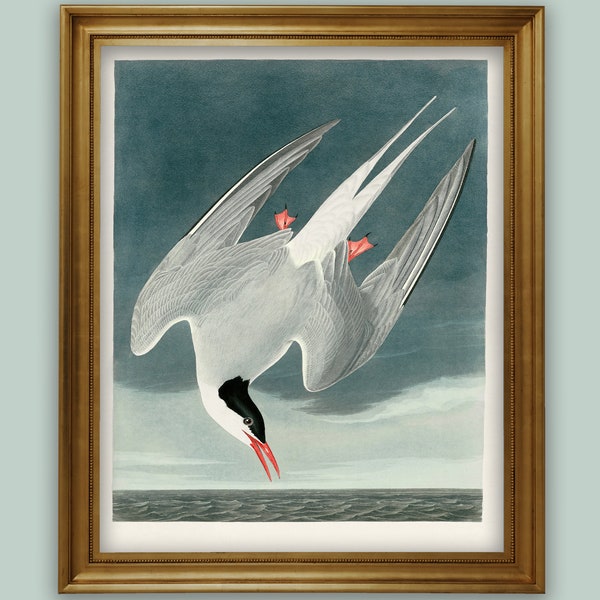
This screenshot has width=600, height=600. What are the coordinates of `frame` in the screenshot? It's located at coord(525,425).